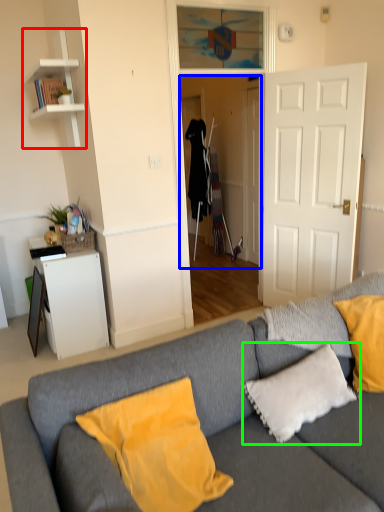
Question: Which object is positioned closest to shelf (highlighted by a red box)? Select from glass door (highlighted by a blue box) and pillow (highlighted by a green box).

Choices:
 (A) glass door
 (B) pillow

Answer: (A)